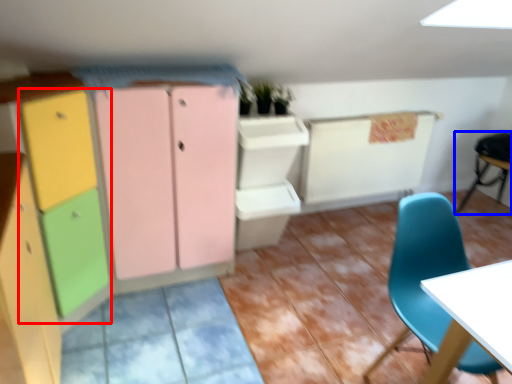
Question: Which object appears farthest to the camera in this image, cabinetry (highlighted by a red box) or chair (highlighted by a blue box)?

Choices:
 (A) cabinetry
 (B) chair

Answer: (B)